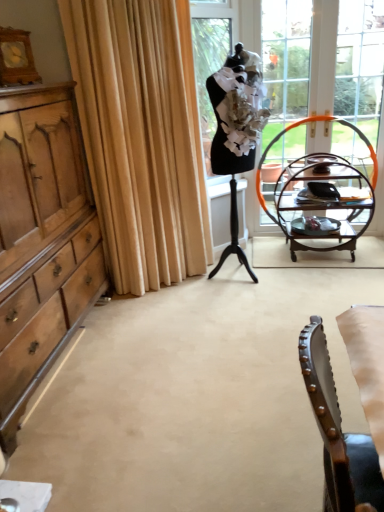
Locate an element on the screen. light brown wood cabinet at left is located at coordinates (41, 240).

Identify the location of beige fabric curtain at left. The image size is (384, 512). [137, 138].

Measure the distance between brown leather chair at lower right and camera.

brown leather chair at lower right is 26.93 inches away from camera.

Find the location of a particular element. The width and height of the screenshot is (384, 512). clear glass window at upper right is located at coordinates (318, 51).

Can you tell me how much beige fabric curtain at left and wooden desk at right differ in facing direction?

The facing directions of beige fabric curtain at left and wooden desk at right are 41.6 degrees apart.

Can you confirm if beige fabric curtain at left is wider than wooden desk at right?

No.

Based on their sizes in the image, would you say beige fabric curtain at left is bigger or smaller than wooden desk at right?

beige fabric curtain at left is bigger than wooden desk at right.

Is beige fabric curtain at left looking in the opposite direction of wooden desk at right?

That's not correct — beige fabric curtain at left is not looking away from wooden desk at right.

Is beige fabric curtain at left inside or outside of light brown wood cabinet at left?

The correct answer is: outside.

Consider the image. How distant is beige fabric curtain at left from light brown wood cabinet at left?

A distance of 20.92 inches exists between beige fabric curtain at left and light brown wood cabinet at left.

Which of these two, beige fabric curtain at left or light brown wood cabinet at left, is smaller?

beige fabric curtain at left is smaller.

Is beige fabric curtain at left facing towards light brown wood cabinet at left?

No.

Considering the positions of objects wooden desk at right and beige fabric curtain at left in the image provided, who is more to the right, wooden desk at right or beige fabric curtain at left?

wooden desk at right is more to the right.

Between wooden desk at right and beige fabric curtain at left, which one is positioned in front?

beige fabric curtain at left is in front.

Is wooden desk at right aimed at beige fabric curtain at left?

No, wooden desk at right is not oriented towards beige fabric curtain at left.

Which of these two, wooden desk at right or beige fabric curtain at left, is thinner?

beige fabric curtain at left is thinner.

Considering the relative sizes of clear glass window at upper right and brown leather chair at lower right in the image provided, is clear glass window at upper right smaller than brown leather chair at lower right?

Yes.

Which object is further away from the camera taking this photo, clear glass window at upper right or brown leather chair at lower right?

clear glass window at upper right is behind.

From a real-world perspective, is clear glass window at upper right positioned above or below brown leather chair at lower right?

clear glass window at upper right is situated higher than brown leather chair at lower right in the real world.

Does point (338, 471) appear closer or farther from the camera than point (36, 375)?

Point (338, 471) is positioned closer to the camera compared to point (36, 375).

You are a GUI agent. You are given a task and a screenshot of the screen. Output one action in this format:
    pyautogui.click(x=<x>, y=<y>)
    Task: Click on the cabinetry to the left of brown leather chair at lower right
    
    Given the screenshot: What is the action you would take?
    pyautogui.click(x=41, y=240)

Can you confirm if brown leather chair at lower right is thinner than light brown wood cabinet at left?

Yes, brown leather chair at lower right is thinner than light brown wood cabinet at left.

From the image's perspective, is brown leather chair at lower right located beneath light brown wood cabinet at left?

Yes.

Locate an element on the screen. curtain that appears above the light brown wood cabinet at left (from the image's perspective) is located at coordinates (137, 138).

Which is correct: light brown wood cabinet at left is inside beige fabric curtain at left, or outside of it?

light brown wood cabinet at left exists outside the volume of beige fabric curtain at left.

How different are the orientations of light brown wood cabinet at left and beige fabric curtain at left in degrees?

The angular difference between light brown wood cabinet at left and beige fabric curtain at left is 47.3 degrees.

Which object is closer to the camera, light brown wood cabinet at left or beige fabric curtain at left?

light brown wood cabinet at left is in front.

Considering the relative sizes of brown leather chair at lower right and wooden desk at right in the image provided, is brown leather chair at lower right shorter than wooden desk at right?

Incorrect, the height of brown leather chair at lower right does not fall short of that of wooden desk at right.

Which is closer, (353, 457) or (347, 197)?

The point (353, 457) is closer.

Can you tell me how much brown leather chair at lower right and wooden desk at right differ in facing direction?

brown leather chair at lower right and wooden desk at right are facing 87.5 degrees away from each other.

Does brown leather chair at lower right appear on the left side of wooden desk at right?

Yes, brown leather chair at lower right is to the left of wooden desk at right.

At what (x,y) coordinates should I click in order to perform the action: click on curtain in front of the wooden desk at right. Please return your answer as a coordinate pair (x, y). Image resolution: width=384 pixels, height=512 pixels. Looking at the image, I should click on (137, 138).

Locate an element on the screen. The image size is (384, 512). curtain to the right of light brown wood cabinet at left is located at coordinates (137, 138).

Which object lies nearer to the anchor point light brown wood cabinet at left, wooden desk at right or beige fabric curtain at left?

beige fabric curtain at left is closer to light brown wood cabinet at left.

When comparing their distances from light brown wood cabinet at left, does beige fabric curtain at left or brown leather chair at lower right seem further?

brown leather chair at lower right lies further to light brown wood cabinet at left than the other object.

Looking at this image, based on their spatial positions, is brown leather chair at lower right or clear glass window at upper right further from beige fabric curtain at left?

Based on the image, brown leather chair at lower right appears to be further to beige fabric curtain at left.

Based on their spatial positions, is beige fabric curtain at left or brown leather chair at lower right further from wooden desk at right?

The object further to wooden desk at right is brown leather chair at lower right.

From the image, which object appears to be farther from light brown wood cabinet at left, clear glass window at upper right or beige fabric curtain at left?

The object further to light brown wood cabinet at left is clear glass window at upper right.

In the scene shown: Looking at the image, which one is located closer to light brown wood cabinet at left, brown leather chair at lower right or wooden desk at right?

brown leather chair at lower right lies closer to light brown wood cabinet at left than the other object.

When comparing their distances from brown leather chair at lower right, does wooden desk at right or beige fabric curtain at left seem closer?

The object closer to brown leather chair at lower right is beige fabric curtain at left.

Which object lies nearer to the anchor point beige fabric curtain at left, wooden desk at right or brown leather chair at lower right?

wooden desk at right is closer to beige fabric curtain at left.

Find the location of a particular element. This screenshot has width=384, height=512. desk between brown leather chair at lower right and clear glass window at upper right along the z-axis is located at coordinates (322, 202).

At what (x,y) coordinates should I click in order to perform the action: click on curtain between light brown wood cabinet at left and clear glass window at upper right. Please return your answer as a coordinate pair (x, y). Looking at the image, I should click on (137, 138).

This screenshot has width=384, height=512. I want to click on desk between light brown wood cabinet at left and clear glass window at upper right from left to right, so click(322, 202).

This screenshot has height=512, width=384. In order to click on curtain between light brown wood cabinet at left and wooden desk at right from left to right in this screenshot , I will do 137,138.